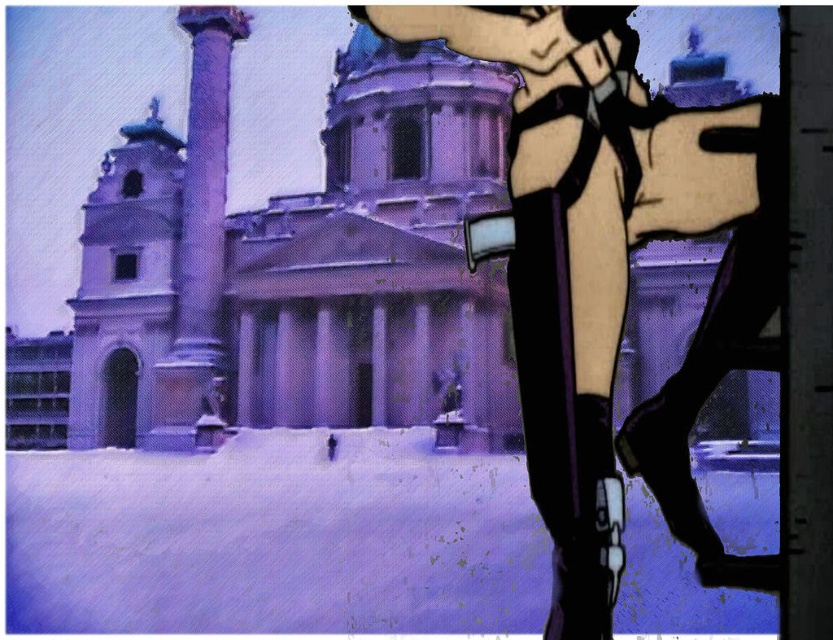
You are standing in the snow covered plaza in front of the grand classical building. You see a point at coordinate (612, 273). What object is represented by that point?

The point at coordinate (612, 273) represents the smooth beige shorts at right.